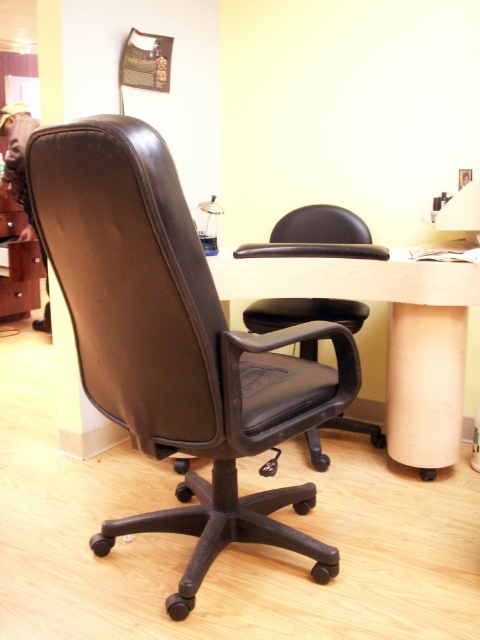
Question: Does light wood computer desk at center appear under matte brown drawer at left?

Choices:
 (A) yes
 (B) no

Answer: (A)

Question: Which object appears farthest from the camera in this image?

Choices:
 (A) matte brown drawer at left
 (B) light wood computer desk at center

Answer: (A)

Question: Which object is the farthest from the matte brown drawer at left?

Choices:
 (A) black leather office chair at center
 (B) light wood computer desk at center

Answer: (A)

Question: Is black leather office chair at center further to the viewer compared to matte brown drawer at left?

Choices:
 (A) yes
 (B) no

Answer: (B)

Question: Which point is farther to the camera?

Choices:
 (A) black leather office chair at center
 (B) matte brown drawer at left

Answer: (B)

Question: Does black leather office chair at center have a lesser width compared to light wood computer desk at center?

Choices:
 (A) no
 (B) yes

Answer: (B)